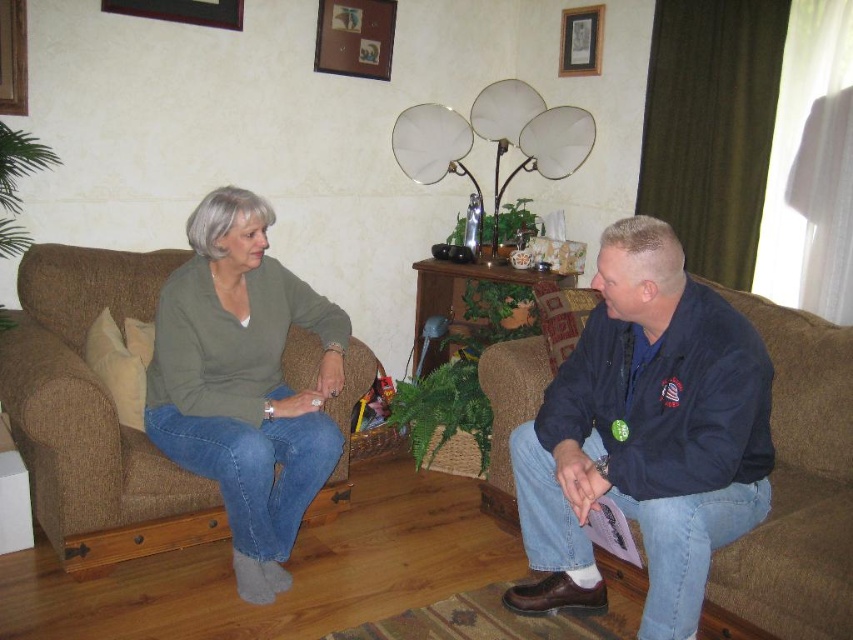
Question: Which point is farther from the camera taking this photo?

Choices:
 (A) (723, 456)
 (B) (225, 234)
 (C) (51, 394)
 (D) (589, 406)

Answer: (B)

Question: Which of these objects is positioned closest to the denim jeans at center?

Choices:
 (A) brown fabric couch at left
 (B) matte green sweater at left

Answer: (B)

Question: Observing the image, what is the correct spatial positioning of dark blue fabric jacket at right in reference to brown fabric couch at left?

Choices:
 (A) right
 (B) left

Answer: (A)

Question: Considering the real-world distances, which object is closest to the matte green sweater at left?

Choices:
 (A) dark blue fabric jacket at right
 (B) brown fabric couch at left
 (C) denim jeans at center

Answer: (B)

Question: Can you confirm if dark blue fabric jacket at right is positioned below matte green sweater at left?

Choices:
 (A) no
 (B) yes

Answer: (B)

Question: Does dark blue fabric jacket at right have a larger size compared to brown fabric couch at left?

Choices:
 (A) yes
 (B) no

Answer: (B)